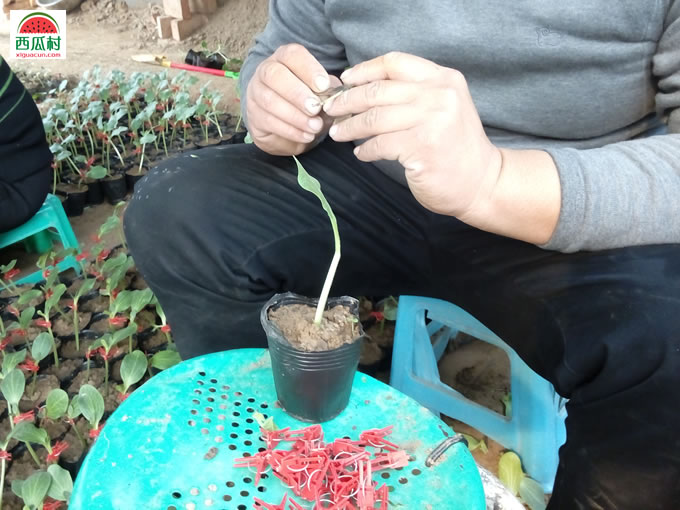
The width and height of the screenshot is (680, 510). In order to click on table in this screenshot , I will do `click(164, 423)`.